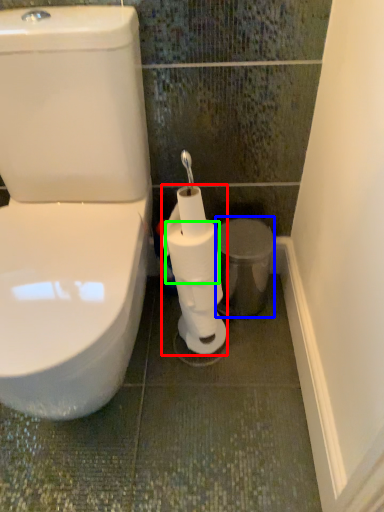
Question: Which object is the farthest from toilet paper (highlighted by a red box)? Choose among these: porcelain (highlighted by a blue box) or toilet paper (highlighted by a green box).

Choices:
 (A) porcelain
 (B) toilet paper

Answer: (A)